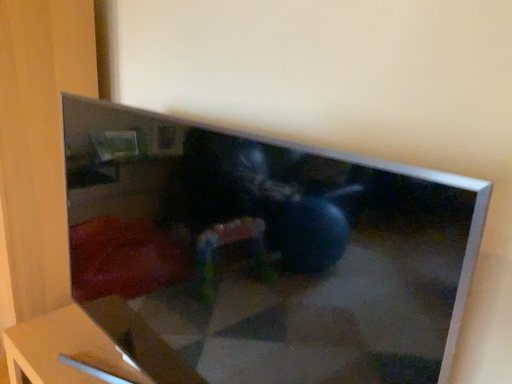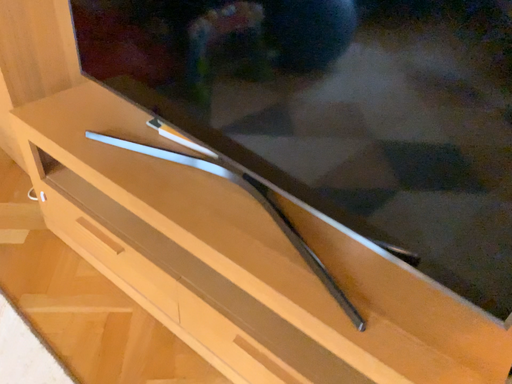
Question: Which way did the camera rotate in the video?

Choices:
 (A) rotated upward
 (B) rotated downward

Answer: (B)